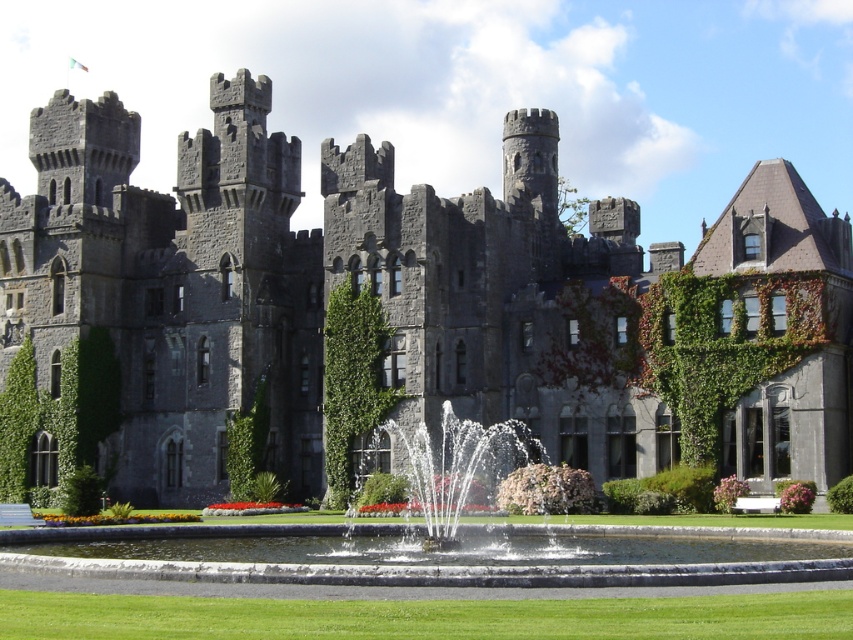
Question: Does white water at center have a smaller size compared to green leafy ivy at center?

Choices:
 (A) no
 (B) yes

Answer: (A)

Question: Which object is farther from the camera taking this photo?

Choices:
 (A) green leafy ivy at center
 (B) white water at center
 (C) green grass at lower center

Answer: (A)

Question: Is green grass at lower center closer to the viewer compared to green leafy ivy at center?

Choices:
 (A) yes
 (B) no

Answer: (A)

Question: Can you confirm if white water at center is positioned below green leafy ivy at center?

Choices:
 (A) yes
 (B) no

Answer: (A)

Question: Which object is positioned closest to the white water at center?

Choices:
 (A) green leafy ivy at center
 (B) green grass at lower center

Answer: (A)

Question: Which point is closer to the camera taking this photo?

Choices:
 (A) (430, 445)
 (B) (337, 387)
 (C) (711, 612)

Answer: (C)